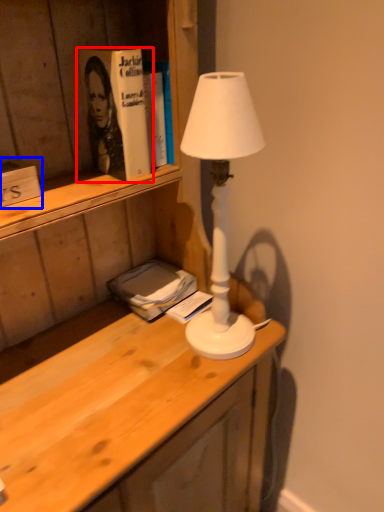
Question: Among these objects, which one is nearest to the camera, paperback book (highlighted by a red box) or book (highlighted by a blue box)?

Choices:
 (A) paperback book
 (B) book

Answer: (B)